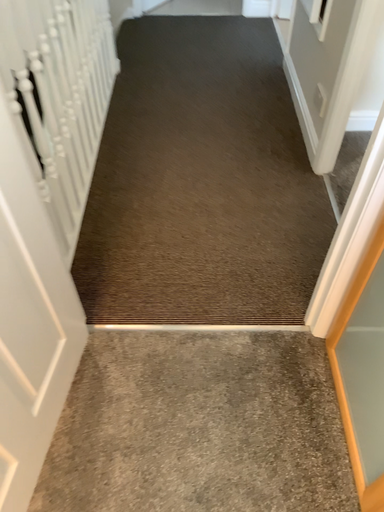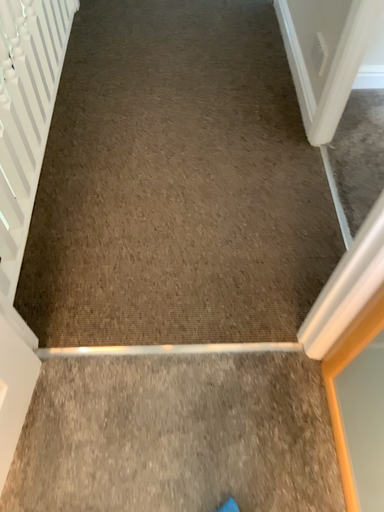
Question: Which way did the camera rotate in the video?

Choices:
 (A) rotated upward
 (B) rotated downward

Answer: (B)